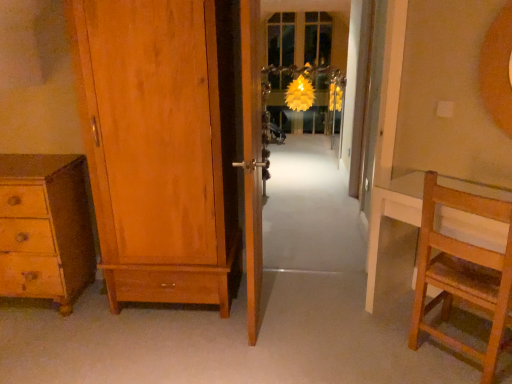
Find the location of `unoccupied area in front of matte wood wardrobe at left, which is the first door in left-to-right order`. unoccupied area in front of matte wood wardrobe at left, which is the first door in left-to-right order is located at coordinates (160, 352).